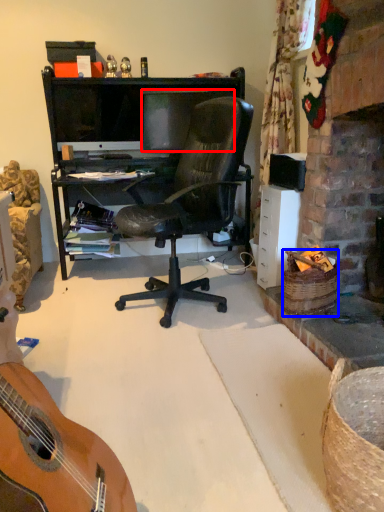
Question: Which point is closer to the camera, television (highlighted by a red box) or picnic basket (highlighted by a blue box)?

Choices:
 (A) television
 (B) picnic basket

Answer: (B)